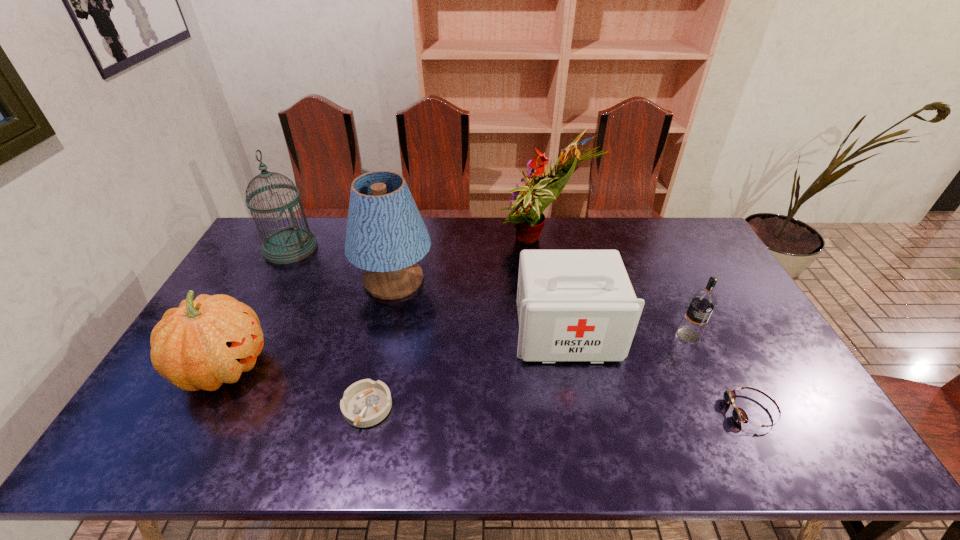
Locate which object is the seventh closest to the bouquet. Please provide its 2D coordinates. Your answer should be formatted as a tuple, i.e. [(x, y)], where the tuple contains the x and y coordinates of a point satisfying the conditions above.

[(209, 341)]

Where is `free space that satisfies the following two spatial constraints: 1. on the label of the sixth tallest object; 2. on the carved face of the pumpkin`? free space that satisfies the following two spatial constraints: 1. on the label of the sixth tallest object; 2. on the carved face of the pumpkin is located at coordinates (704, 367).

The height and width of the screenshot is (540, 960). I want to click on vacant space that satisfies the following two spatial constraints: 1. on the carved face of the pumpkin; 2. on the right side of the ashtray, so click(x=202, y=408).

Where is `vacant region that satisfies the following two spatial constraints: 1. on the label of the third shortest object; 2. on the carved face of the pumpkin`? Image resolution: width=960 pixels, height=540 pixels. vacant region that satisfies the following two spatial constraints: 1. on the label of the third shortest object; 2. on the carved face of the pumpkin is located at coordinates (704, 367).

Find the location of a particular element. vacant area that satisfies the following two spatial constraints: 1. on the front-facing side of the lampshade; 2. on the right side of the birdcage is located at coordinates (274, 280).